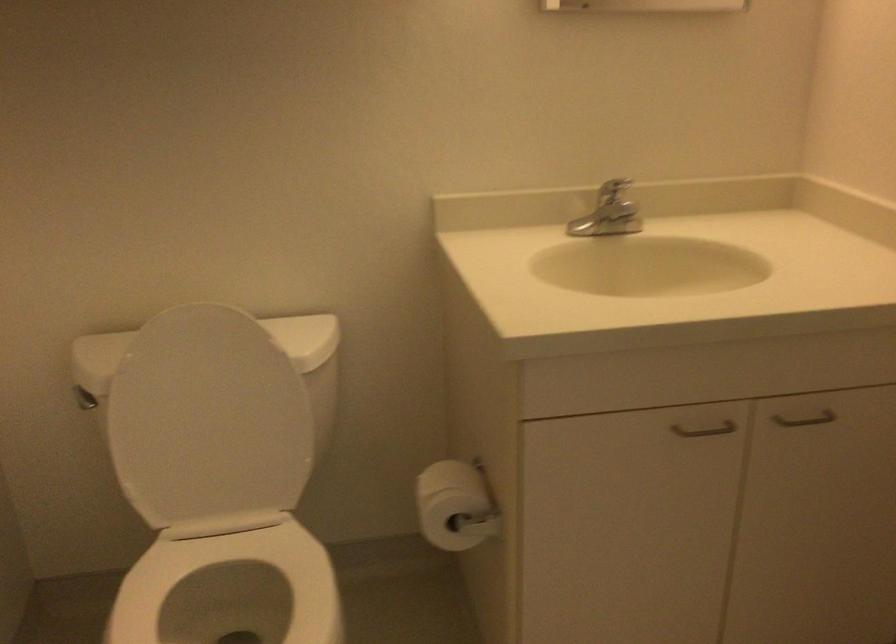
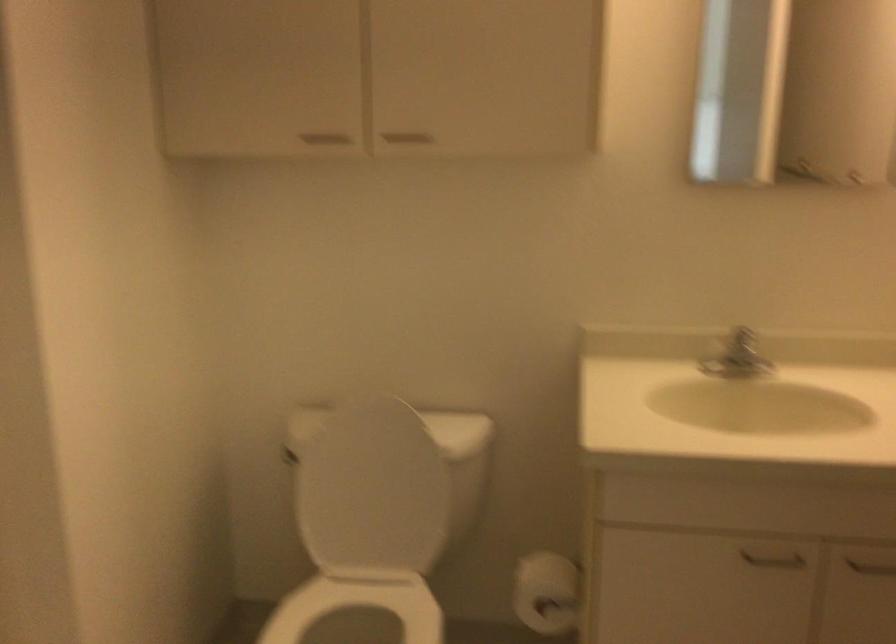
Where in the second image is the point corresponding to the point at 615,216 from the first image?

(737, 357)